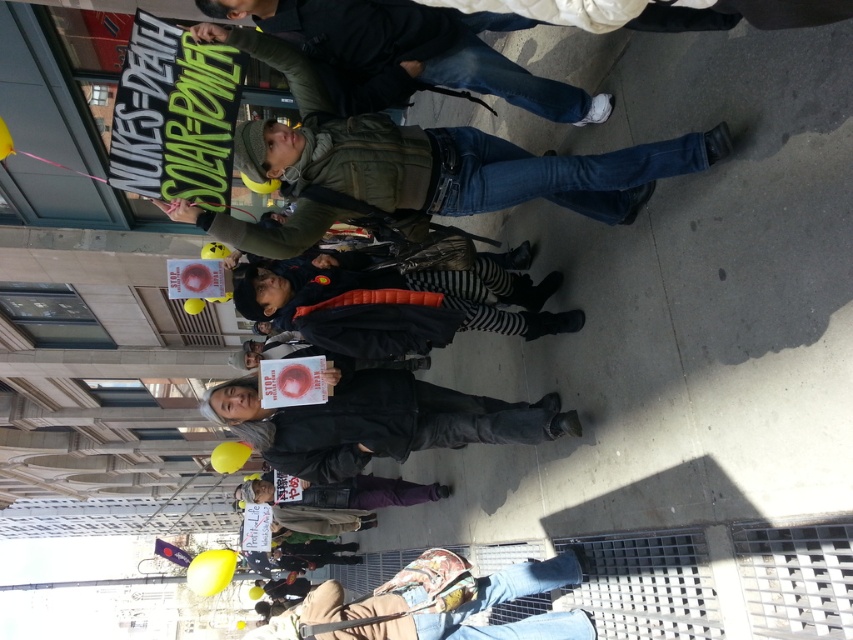
Question: Which point appears farthest from the camera in this image?

Choices:
 (A) (341, 449)
 (B) (519, 621)

Answer: (A)

Question: Which point is farther to the camera?

Choices:
 (A) (370, 611)
 (B) (358, 433)

Answer: (B)

Question: Is denim jeans at upper center thinner than denim jeans at lower center?

Choices:
 (A) yes
 (B) no

Answer: (B)

Question: In this image, where is denim jeans at upper center located relative to gray fabric jacket at center?

Choices:
 (A) left
 (B) right

Answer: (B)

Question: Is denim jeans at upper center above gray fabric jacket at center?

Choices:
 (A) yes
 (B) no

Answer: (A)

Question: Estimate the real-world distances between objects in this image. Which object is closer to the denim jeans at lower center?

Choices:
 (A) denim jeans at upper center
 (B) gray fabric jacket at center

Answer: (B)